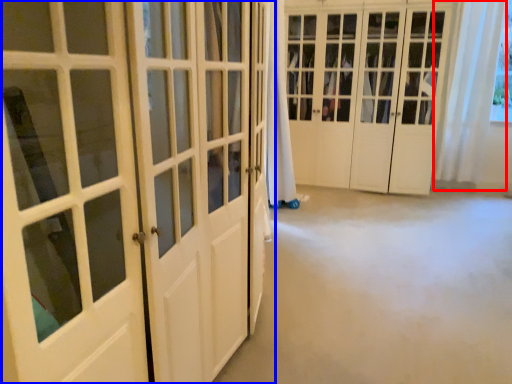
Question: Which object appears closest to the camera in this image, curtain (highlighted by a red box) or door (highlighted by a blue box)?

Choices:
 (A) curtain
 (B) door

Answer: (B)